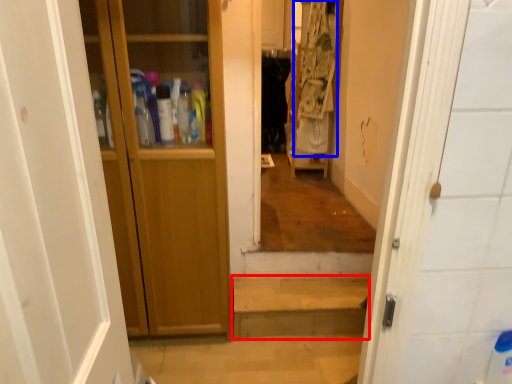
Question: Which point is closer to the camera, stairwell (highlighted by a red box) or laundry (highlighted by a blue box)?

Choices:
 (A) stairwell
 (B) laundry

Answer: (A)